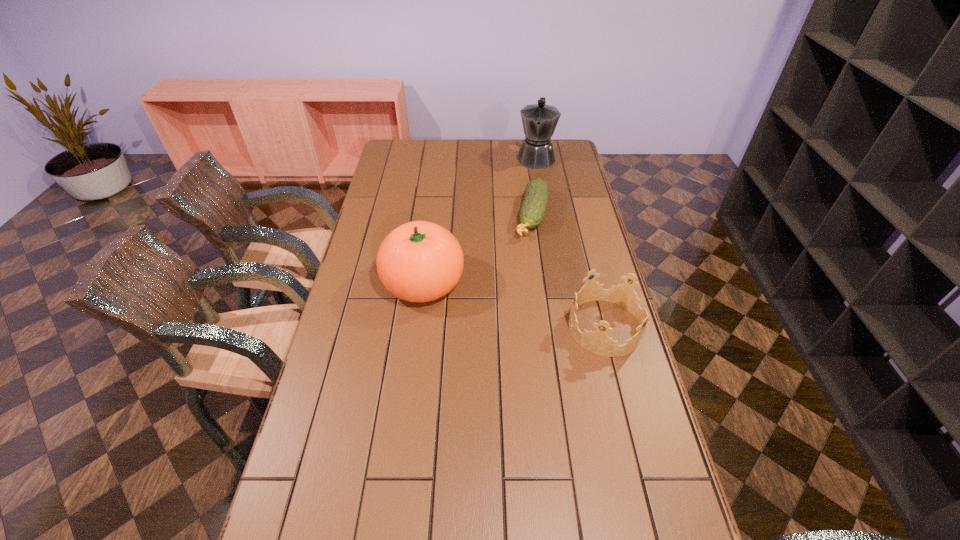
At what (x,y) coordinates should I click in order to perform the action: click on free region located at the blossom end of the shortest object. Please return your answer as a coordinate pair (x, y). Looking at the image, I should click on (516, 294).

The height and width of the screenshot is (540, 960). I want to click on blank space located at the blossom end of the shortest object, so click(x=512, y=309).

At what (x,y) coordinates should I click in order to perform the action: click on vacant area situated at the blossom end of the shortest object. Please return your answer as a coordinate pair (x, y). This screenshot has width=960, height=540. Looking at the image, I should click on (512, 309).

You are a GUI agent. You are given a task and a screenshot of the screen. Output one action in this format:
    pyautogui.click(x=<x>, y=<y>)
    Task: Click on the free space located at the spout of the farthest object
    This screenshot has height=540, width=960.
    Given the screenshot: What is the action you would take?
    pyautogui.click(x=526, y=225)

The width and height of the screenshot is (960, 540). What are the coordinates of `vacant space located at the spout of the farthest object` in the screenshot? It's located at (534, 180).

Find the location of a particular element. The image size is (960, 540). vacant space located at the spout of the farthest object is located at coordinates (529, 211).

Identify the location of object at the far edge. (539, 121).

Locate an element on the screen. This screenshot has width=960, height=540. object that is at the left edge is located at coordinates (420, 261).

This screenshot has height=540, width=960. Identify the location of tiara at the right edge. (598, 342).

Identify the location of coffeepot that is at the right edge. (539, 121).